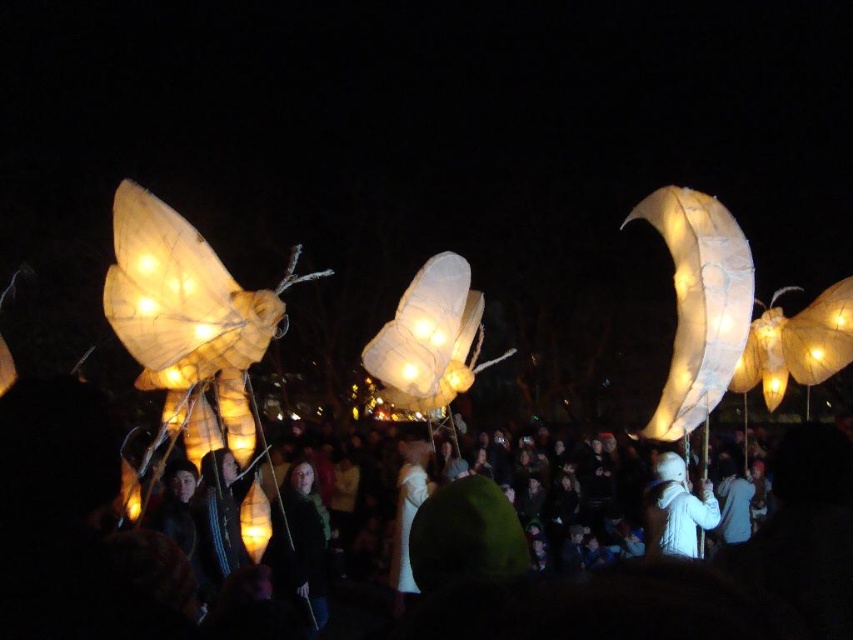
You are part of the lantern procession and need to determine which lantern is wider. You see the illuminated paper crescent moon at right and the illuminated paper lantern at center. Which one is wider?

The illuminated paper lantern at center is wider than the illuminated paper crescent moon at right.

You are organizing a night event and want to know which object is wider between the white paper lanterns at center and the illuminated paper crescent moon at right. Can you tell me?

The white paper lanterns at center are wider than the illuminated paper crescent moon at right according to the description.

You are a photographer standing at the edge of the crowd. You want to capture a photo that includes both the white paper lanterns at center and the illuminated paper lantern at center. Given that your camera can only focus on objects within a 20 meter range, will you be able to get both in the frame?

The white paper lanterns at center and the illuminated paper lantern at center are 22.70 meters apart from each other. Since the distance between them exceeds the camera focus range of 20 meters, you won